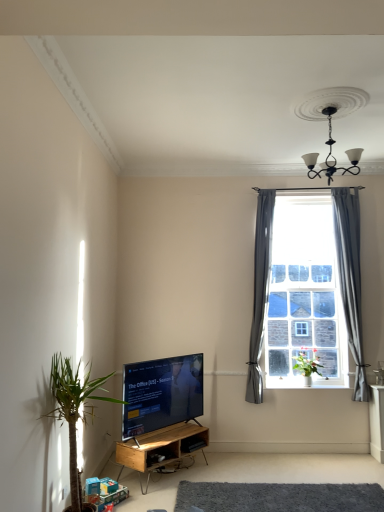
Question: Is the surface of clear glass window at center in direct contact with green leafy plant at lower left, the 1th houseplant positioned from the front?

Choices:
 (A) yes
 (B) no

Answer: (B)

Question: Is clear glass window at center looking in the opposite direction of green leafy plant at lower left, the first houseplant from the left?

Choices:
 (A) yes
 (B) no

Answer: (B)

Question: Does clear glass window at center come behind green leafy plant at lower left, the first houseplant from the left?

Choices:
 (A) no
 (B) yes

Answer: (B)

Question: From a real-world perspective, is clear glass window at center under green leafy plant at lower left, the 1th houseplant positioned from the front?

Choices:
 (A) no
 (B) yes

Answer: (A)

Question: Considering the relative sizes of clear glass window at center and green leafy plant at lower left, placed as the 2th houseplant when sorted from back to front, in the image provided, is clear glass window at center shorter than green leafy plant at lower left, placed as the 2th houseplant when sorted from back to front,?

Choices:
 (A) yes
 (B) no

Answer: (B)

Question: Is clear glass window at center positioned far away from green leafy plant at lower left, the first houseplant from the left?

Choices:
 (A) no
 (B) yes

Answer: (B)

Question: Can you confirm if black glossy tv at lower center is bigger than clear glass window at center?

Choices:
 (A) yes
 (B) no

Answer: (B)

Question: Can you confirm if black glossy tv at lower center is positioned to the left of clear glass window at center?

Choices:
 (A) yes
 (B) no

Answer: (A)

Question: Is black glossy tv at lower center positioned beyond the bounds of clear glass window at center?

Choices:
 (A) yes
 (B) no

Answer: (A)

Question: Considering the relative positions of black glossy tv at lower center and clear glass window at center in the image provided, is black glossy tv at lower center behind clear glass window at center?

Choices:
 (A) no
 (B) yes

Answer: (A)

Question: Could you tell me if black glossy tv at lower center is turned towards clear glass window at center?

Choices:
 (A) no
 (B) yes

Answer: (A)

Question: From the image's perspective, would you say black glossy tv at lower center is shown under clear glass window at center?

Choices:
 (A) no
 (B) yes

Answer: (B)

Question: Does woodenmaterial/textureshelf at lower center have a greater height compared to gray fabric curtain at right, which ranks as the 2th curtain in right-to-left order?

Choices:
 (A) yes
 (B) no

Answer: (B)